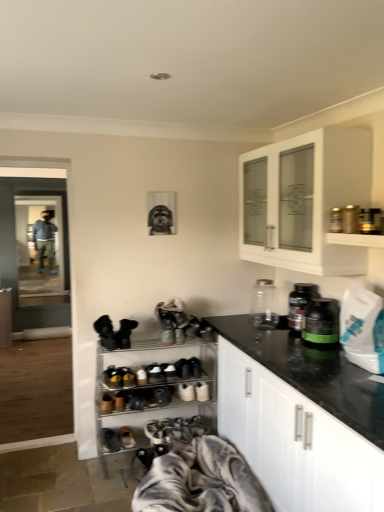
Question: Could you tell me if white glossy cabinet at upper right, the first cabinetry in the top-to-bottom sequence, is turned towards gray textured blanket at lower center?

Choices:
 (A) yes
 (B) no

Answer: (B)

Question: Is white glossy cabinet at upper right, which ranks as the second cabinetry in back-to-front order, thinner than gray textured blanket at lower center?

Choices:
 (A) no
 (B) yes

Answer: (B)

Question: Is white glossy cabinet at upper right, the first cabinetry in the top-to-bottom sequence, positioned with its back to gray textured blanket at lower center?

Choices:
 (A) no
 (B) yes

Answer: (A)

Question: From the image's perspective, does white glossy cabinet at upper right, the 3th cabinetry when ordered from bottom to top, appear lower than gray textured blanket at lower center?

Choices:
 (A) yes
 (B) no

Answer: (B)

Question: From a real-world perspective, does white glossy cabinet at upper right, the first cabinetry in the top-to-bottom sequence, sit lower than gray textured blanket at lower center?

Choices:
 (A) no
 (B) yes

Answer: (A)

Question: From a real-world perspective, does white glossy cabinet at upper right, which ranks as the second cabinetry in back-to-front order, stand above gray textured blanket at lower center?

Choices:
 (A) yes
 (B) no

Answer: (A)

Question: Is metallic shoe rack at lower center, which appears as the 1th shelf when ordered from the bottom, positioned beyond the bounds of white glossy cabinet at left, which ranks as the second cabinetry in bottom-to-top order?

Choices:
 (A) yes
 (B) no

Answer: (A)

Question: Could you tell me if metallic shoe rack at lower center, which appears as the 1th shelf when ordered from the bottom, is turned towards white glossy cabinet at left, the first cabinetry when ordered from back to front?

Choices:
 (A) no
 (B) yes

Answer: (A)

Question: From the image's perspective, is metallic shoe rack at lower center, acting as the second shelf starting from the top, located above white glossy cabinet at left, marked as the 3th cabinetry in a right-to-left arrangement?

Choices:
 (A) no
 (B) yes

Answer: (A)

Question: Is metallic shoe rack at lower center, which is the 2th shelf in right-to-left order, to the right of white glossy cabinet at left, the first cabinetry when ordered from back to front, from the viewer's perspective?

Choices:
 (A) no
 (B) yes

Answer: (B)

Question: Is metallic shoe rack at lower center, the 2th shelf when ordered from front to back, closer to camera compared to white glossy cabinet at left, the 3th cabinetry when ordered from front to back?

Choices:
 (A) no
 (B) yes

Answer: (B)

Question: Are metallic shoe rack at lower center, arranged as the first shelf when viewed from the left, and white glossy cabinet at left, which ranks as the first cabinetry in left-to-right order, making contact?

Choices:
 (A) no
 (B) yes

Answer: (A)

Question: Considering the relative positions of white glossy cabinet at upper right, the second cabinetry viewed from the left, and brown suede shoe at lower center, the 3th footwear in the bottom-to-top sequence, in the image provided, is white glossy cabinet at upper right, the second cabinetry viewed from the left, in front of brown suede shoe at lower center, the 3th footwear in the bottom-to-top sequence,?

Choices:
 (A) yes
 (B) no

Answer: (A)